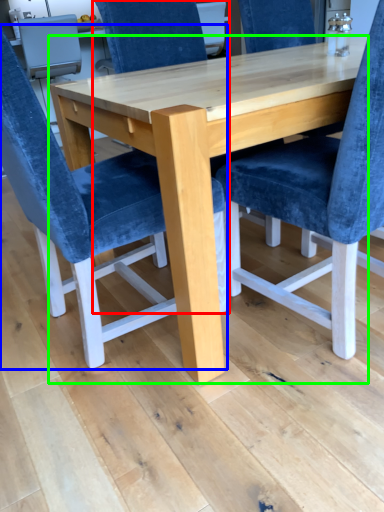
Question: Which object is positioned farthest from chair (highlighted by a red box)? Select from chair (highlighted by a blue box) and table (highlighted by a green box).

Choices:
 (A) chair
 (B) table

Answer: (A)